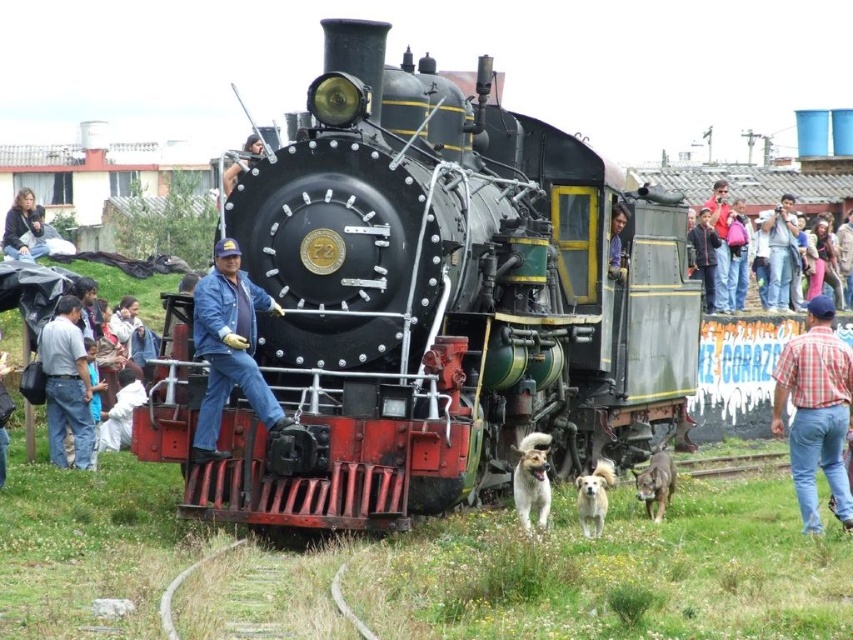
Does point (524, 483) lie behind point (618, 208)?

No, it is in front of (618, 208).

Is golden fur dog at lower center bigger than blue denim shirt at center?

Yes, golden fur dog at lower center is bigger than blue denim shirt at center.

Is point (514, 483) in front of point (619, 228)?

Yes, point (514, 483) is closer to viewer.

Identify the location of golden fur dog at lower center. tap(531, 480).

Image resolution: width=853 pixels, height=640 pixels. What do you see at coordinates (22, 228) in the screenshot?
I see `dark blue denim jacket at lower left` at bounding box center [22, 228].

Who is more distant from viewer, (33, 240) or (624, 268)?

Positioned behind is point (33, 240).

Does point (21, 204) come closer to viewer compared to point (613, 262)?

No, (21, 204) is further to viewer.

This screenshot has height=640, width=853. Identify the location of dark blue denim jacket at lower left. (22, 228).

Does blue denim jeans at center appear over denim jeans at lower left?

Indeed, blue denim jeans at center is positioned over denim jeans at lower left.

Can you confirm if blue denim jeans at center is wider than denim jeans at lower left?

Yes.

Is point (239, 307) behind point (91, 449)?

No, (239, 307) is in front of (91, 449).

You are a GUI agent. You are given a task and a screenshot of the screen. Output one action in this format:
    pyautogui.click(x=<x>, y=<y>)
    Task: Click on the blue denim jeans at center
    The height and width of the screenshot is (640, 853).
    Given the screenshot: What is the action you would take?
    pyautogui.click(x=229, y=346)